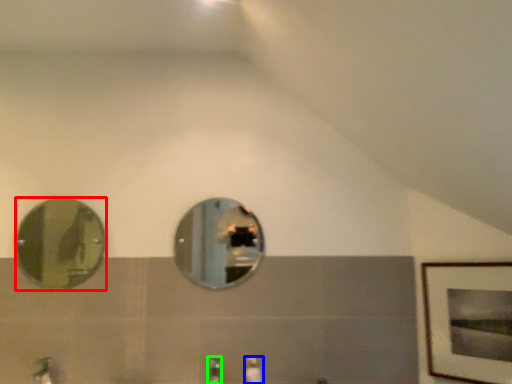
Question: Considering the real-world distances, which object is farthest from mirror (highlighted by a red box)? toiletry (highlighted by a blue box) or faucet (highlighted by a green box)?

Choices:
 (A) toiletry
 (B) faucet

Answer: (A)